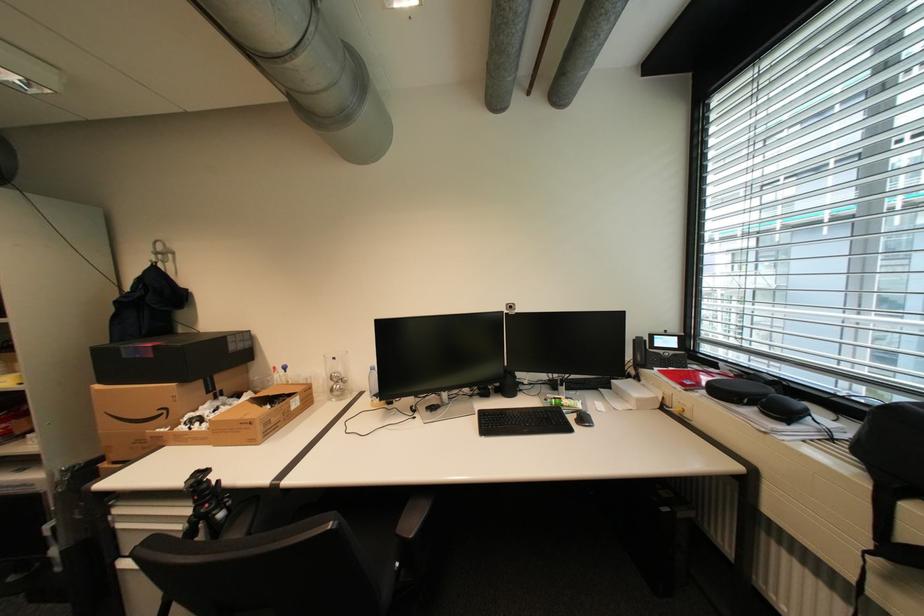
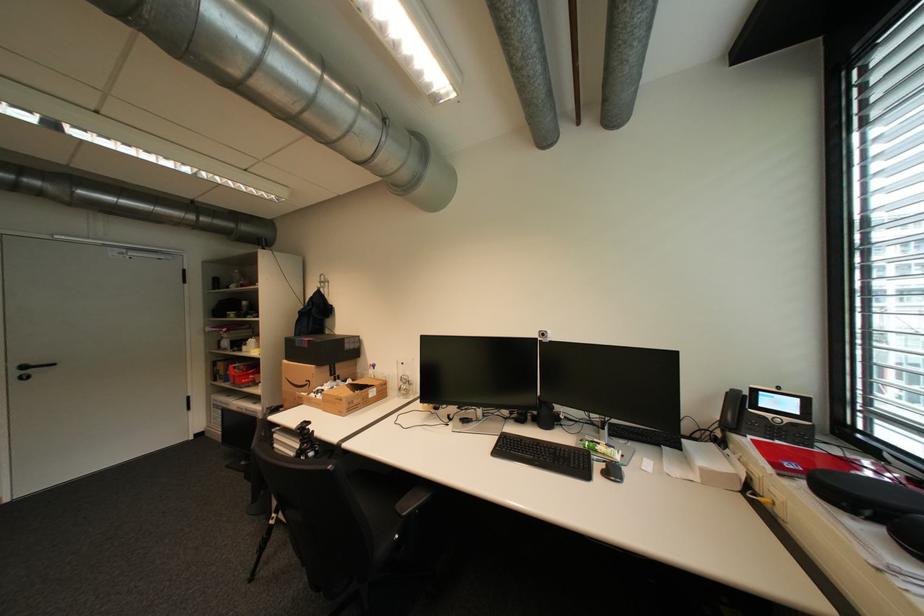
Locate, in the second image, the point that corresponds to the point at 686,347 in the first image.

(806, 413)